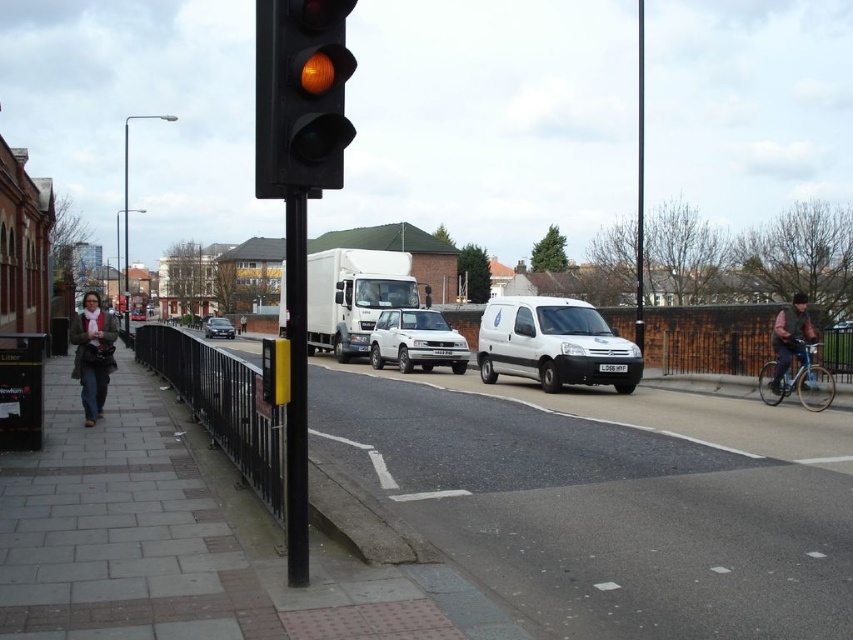
Question: In this image, where is gray concrete sidewalk at lower left located relative to white matte car at center?

Choices:
 (A) left
 (B) right

Answer: (B)

Question: Considering the real-world distances, which object is farthest from the silver metallic bicycle at right?

Choices:
 (A) white matte car at center
 (B) matte brown coat at left
 (C) dark brown leather jacket at right
 (D) gray concrete sidewalk at lower left

Answer: (A)

Question: Can you confirm if silver metallic bicycle at right is positioned above black metal pole at center?

Choices:
 (A) yes
 (B) no

Answer: (B)

Question: Does gray concrete sidewalk at lower left appear on the right side of dark brown leather jacket at right?

Choices:
 (A) yes
 (B) no

Answer: (B)

Question: Which point is farther to the camera?

Choices:
 (A) paved sidewalk at lower left
 (B) white matte suv at center
 (C) white matte van at center

Answer: (B)

Question: Which point appears farthest from the camera in this image?

Choices:
 (A) click(378, 358)
 (B) click(105, 336)
 (C) click(544, 326)
 (D) click(776, 378)

Answer: (A)